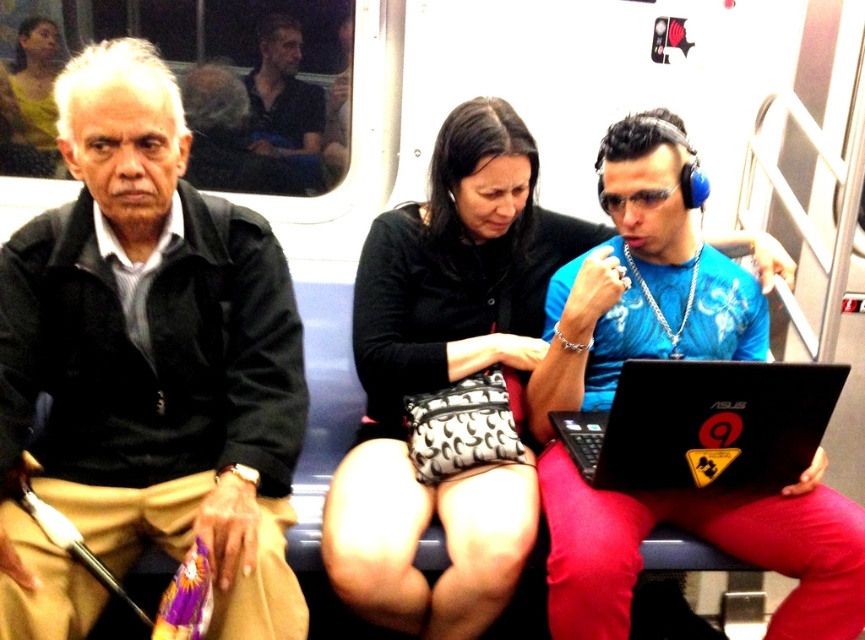
Question: Among these points, which one is nearest to the camera?

Choices:
 (A) (791, 406)
 (B) (290, 179)

Answer: (A)

Question: Is blue t-shirt at center smaller than black matte laptop at center?

Choices:
 (A) yes
 (B) no

Answer: (B)

Question: Which point is farther from the camera taking this photo?

Choices:
 (A) (264, 154)
 (B) (165, 406)

Answer: (A)

Question: Observing the image, what is the correct spatial positioning of black matte laptop at center in reference to dark blue shirt at upper center?

Choices:
 (A) above
 (B) below

Answer: (B)

Question: Estimate the real-world distances between objects in this image. Which object is closer to the dark blue shirt at upper center?

Choices:
 (A) matte yellow shirt at upper left
 (B) blue t-shirt at center

Answer: (A)

Question: Does matte black jacket at left have a greater width compared to blue t-shirt at center?

Choices:
 (A) no
 (B) yes

Answer: (A)